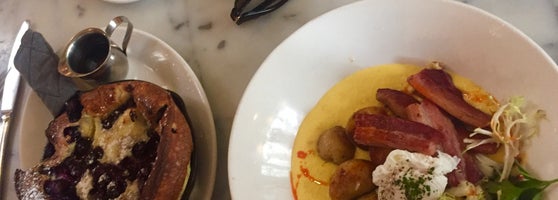
You are a GUI agent. You are given a task and a screenshot of the screen. Output one action in this format:
    pyautogui.click(x=<x>, y=<y>)
    Task: Click on the nasty looking cream table
    
    Given the screenshot: What is the action you would take?
    pyautogui.click(x=221, y=147)